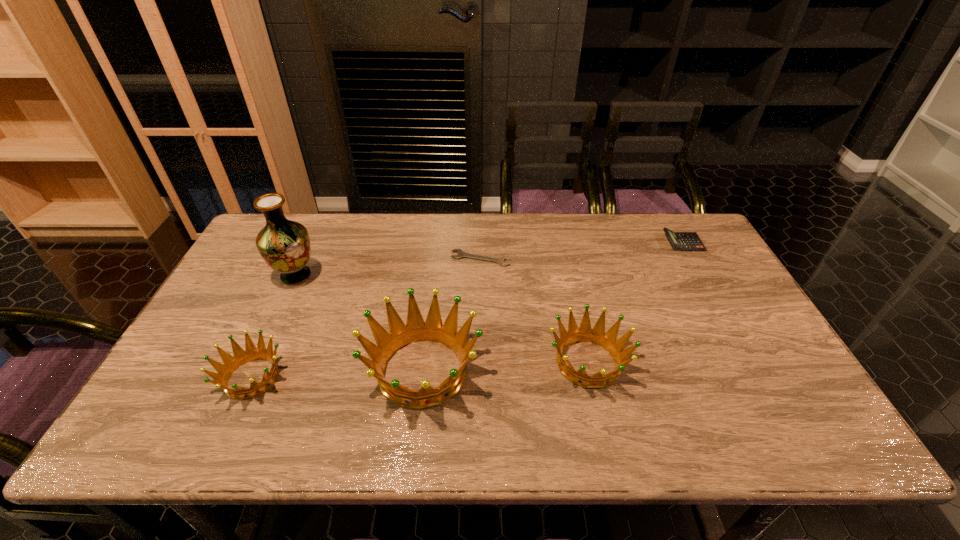
Identify the location of object that is at the right edge. (685, 241).

Locate an element on the screen. This screenshot has height=540, width=960. object that is at the near left corner is located at coordinates (251, 353).

At what (x,y) coordinates should I click in order to perform the action: click on object that is at the far right corner. Please return your answer as a coordinate pair (x, y). The width and height of the screenshot is (960, 540). Looking at the image, I should click on (685, 241).

I want to click on free space at the far edge of the desktop, so click(525, 255).

The height and width of the screenshot is (540, 960). I want to click on vacant space at the near edge of the desktop, so click(x=565, y=379).

Locate an element on the screen. The image size is (960, 540). vacant space at the left edge of the desktop is located at coordinates 195,356.

Image resolution: width=960 pixels, height=540 pixels. In order to click on free spot at the near right corner of the desktop in this screenshot , I will do `click(739, 384)`.

Where is `vacant space that's between the second shortest object and the third shortest object`? vacant space that's between the second shortest object and the third shortest object is located at coordinates [468, 310].

Image resolution: width=960 pixels, height=540 pixels. Find the location of `free space between the rightmost object and the fourth tallest object`. free space between the rightmost object and the fourth tallest object is located at coordinates (468, 310).

You are a GUI agent. You are given a task and a screenshot of the screen. Output one action in this format:
    pyautogui.click(x=<x>, y=<y>)
    Task: Click on the free space between the second tallest object and the second shortest object
    The width and height of the screenshot is (960, 540).
    Given the screenshot: What is the action you would take?
    pyautogui.click(x=553, y=306)